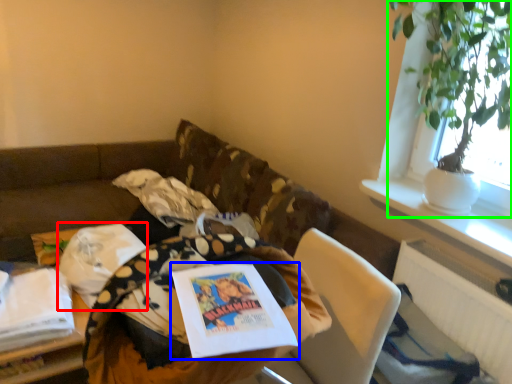
Question: Considering the real-world distances, which object is closest to material (highlighted by a red box)? book (highlighted by a blue box) or houseplant (highlighted by a green box).

Choices:
 (A) book
 (B) houseplant

Answer: (A)